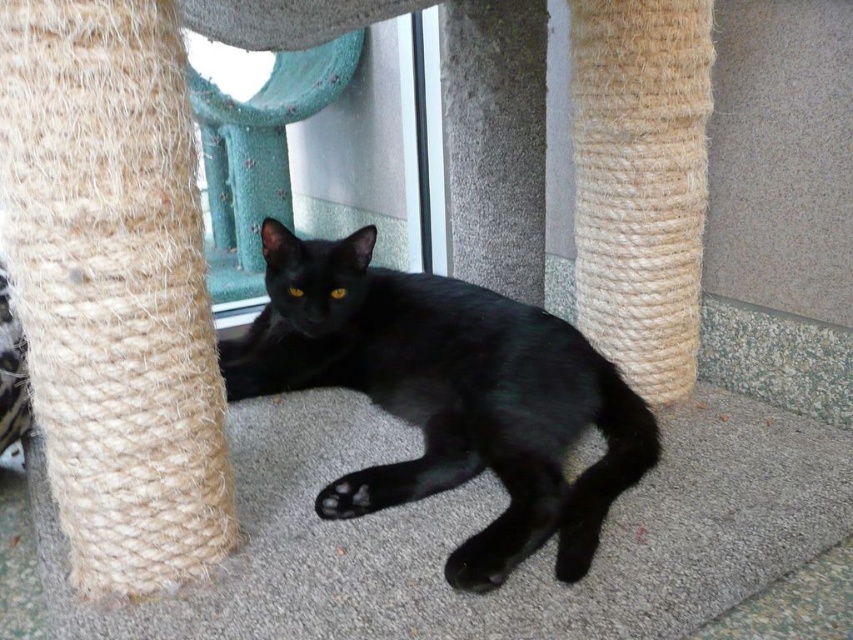
Question: Is black matte fur cat at center wider than transparent glass door at center?

Choices:
 (A) yes
 (B) no

Answer: (A)

Question: Which of the following is the closest to the observer?

Choices:
 (A) (631, 413)
 (B) (444, 253)

Answer: (A)

Question: Which point is farther to the camera?

Choices:
 (A) black matte fur cat at center
 (B) transparent glass door at center

Answer: (B)

Question: Can you confirm if black matte fur cat at center is wider than transparent glass door at center?

Choices:
 (A) no
 (B) yes

Answer: (B)

Question: Observing the image, what is the correct spatial positioning of black matte fur cat at center in reference to transparent glass door at center?

Choices:
 (A) below
 (B) above

Answer: (A)